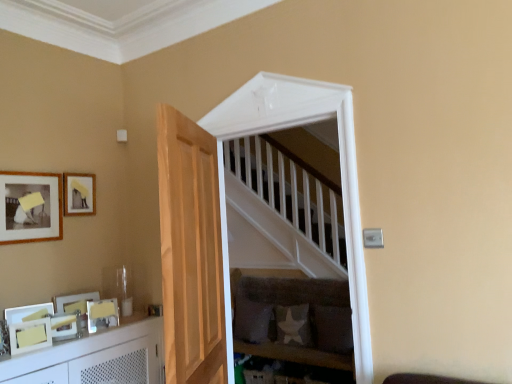
Locate an element on the screen. white glossy picture frame at lower left, placed as the 1th picture frame when sorted from bottom to top is located at coordinates [30, 336].

How much space does dark fabric pillow at lower center, which is the 1th pillow in right-to-left order, occupy horizontally?

The width of dark fabric pillow at lower center, which is the 1th pillow in right-to-left order, is 6.25 inches.

Find the location of `light brown wooden door at center`. light brown wooden door at center is located at coordinates tap(190, 251).

The width and height of the screenshot is (512, 384). What do you see at coordinates (26, 312) in the screenshot?
I see `matte white picture frame at lower left, the 3th picture frame from the top` at bounding box center [26, 312].

What do you see at coordinates (293, 325) in the screenshot? The image size is (512, 384). I see `white fabric pillow at lower center, arranged as the 2th pillow when viewed from the left` at bounding box center [293, 325].

Locate an element on the screen. white glossy picture frame at lower left, acting as the 5th picture frame starting from the top is located at coordinates coord(30,336).

Consider the image. From a real-world perspective, is light brown wooden door at center over white glossy picture frame at lower left, placed as the 1th picture frame when sorted from bottom to top?

Indeed, from a real-world perspective, light brown wooden door at center stands above white glossy picture frame at lower left, placed as the 1th picture frame when sorted from bottom to top.

Identify the location of door on the right of white glossy picture frame at lower left, placed as the 1th picture frame when sorted from bottom to top. (190, 251).

From the image's perspective, is light brown wooden door at center located above or below white glossy picture frame at lower left, placed as the 1th picture frame when sorted from bottom to top?

Based on their image positions, light brown wooden door at center is located above white glossy picture frame at lower left, placed as the 1th picture frame when sorted from bottom to top.

From the picture: In the image, is light brown wooden door at center on the left side or the right side of white glossy picture frame at lower left, placed as the 1th picture frame when sorted from bottom to top?

light brown wooden door at center is positioned on white glossy picture frame at lower left, placed as the 1th picture frame when sorted from bottom to top,'s right side.

Looking at this image, considering the sizes of objects light brown wooden door at center and white fabric pillow at lower center, placed as the first pillow when sorted from left to right, in the image provided, who is bigger, light brown wooden door at center or white fabric pillow at lower center, placed as the first pillow when sorted from left to right,?

Bigger between the two is light brown wooden door at center.

Considering the positions of point (202, 168) and point (246, 308), is point (202, 168) closer or farther from the camera than point (246, 308)?

Point (202, 168) is closer to the camera than point (246, 308).

From the image's perspective, relative to white fabric pillow at lower center, placed as the first pillow when sorted from left to right, is light brown wooden door at center above or below?

light brown wooden door at center is situated higher than white fabric pillow at lower center, placed as the first pillow when sorted from left to right, in the image.

Is light brown wooden door at center facing away from white fabric pillow at lower center, the 3th pillow viewed from the right?

No, light brown wooden door at center is not facing the opposite direction of white fabric pillow at lower center, the 3th pillow viewed from the right.

From a real-world perspective, is matte white picture frame at lower left, arranged as the 3th picture frame when ordered from the bottom, above or below matte gold picture frame at lower left, which is counted as the fourth picture frame, starting from the top?

In terms of real-world spatial position, matte white picture frame at lower left, arranged as the 3th picture frame when ordered from the bottom, is above matte gold picture frame at lower left, which is counted as the fourth picture frame, starting from the top.

Considering the relative sizes of matte white picture frame at lower left, arranged as the 3th picture frame when ordered from the bottom, and matte gold picture frame at lower left, which is counted as the fourth picture frame, starting from the top, in the image provided, is matte white picture frame at lower left, arranged as the 3th picture frame when ordered from the bottom, taller than matte gold picture frame at lower left, which is counted as the fourth picture frame, starting from the top,?

In fact, matte white picture frame at lower left, arranged as the 3th picture frame when ordered from the bottom, may be shorter than matte gold picture frame at lower left, which is counted as the fourth picture frame, starting from the top.

Is the depth of matte white picture frame at lower left, arranged as the 3th picture frame when ordered from the bottom, less than that of matte gold picture frame at lower left, which is the 2th picture frame in bottom-to-top order?

Yes, it is in front of matte gold picture frame at lower left, which is the 2th picture frame in bottom-to-top order.

Is the surface of light brown wooden door at center in direct contact with matte black picture frame at upper left, which ranks as the 4th picture frame in bottom-to-top order?

No, light brown wooden door at center is not with matte black picture frame at upper left, which ranks as the 4th picture frame in bottom-to-top order.

In the scene shown: Based on their sizes in the image, would you say light brown wooden door at center is bigger or smaller than matte black picture frame at upper left, which ranks as the 4th picture frame in bottom-to-top order?

In the image, light brown wooden door at center appears to be larger than matte black picture frame at upper left, which ranks as the 4th picture frame in bottom-to-top order.

Identify the location of door below the matte black picture frame at upper left, acting as the second picture frame starting from the top (from the image's perspective). This screenshot has width=512, height=384. (190, 251).

What's the angular difference between light brown wooden door at center and matte black picture frame at upper left, which ranks as the 4th picture frame in bottom-to-top order,'s facing directions?

The angle between the facing direction of light brown wooden door at center and the facing direction of matte black picture frame at upper left, which ranks as the 4th picture frame in bottom-to-top order, is 155 degrees.

From their relative heights in the image, would you say white wooden staircase at center is taller or shorter than white glossy picture frame at lower left, acting as the 5th picture frame starting from the top?

white wooden staircase at center is taller than white glossy picture frame at lower left, acting as the 5th picture frame starting from the top.

Could white glossy picture frame at lower left, placed as the 1th picture frame when sorted from bottom to top, be considered to be inside white wooden staircase at center?

No, white glossy picture frame at lower left, placed as the 1th picture frame when sorted from bottom to top, is not inside white wooden staircase at center.

Between white wooden staircase at center and white glossy picture frame at lower left, acting as the 5th picture frame starting from the top, which one has smaller width?

white glossy picture frame at lower left, acting as the 5th picture frame starting from the top.

Is white wooden staircase at center touching white glossy picture frame at lower left, acting as the 5th picture frame starting from the top?

white wooden staircase at center and white glossy picture frame at lower left, acting as the 5th picture frame starting from the top, are clearly separated.

Considering the relative positions of white fabric pillow at lower center, arranged as the 2th pillow when viewed from the left, and light brown wooden door at center in the image provided, is white fabric pillow at lower center, arranged as the 2th pillow when viewed from the left, behind light brown wooden door at center?

Yes, it is.

Is white fabric pillow at lower center, arranged as the 2th pillow when viewed from the left, facing towards light brown wooden door at center?

Yes, white fabric pillow at lower center, arranged as the 2th pillow when viewed from the left, is aimed at light brown wooden door at center.

Is white fabric pillow at lower center, arranged as the 2th pillow when viewed from the left, placed right next to light brown wooden door at center?

No, white fabric pillow at lower center, arranged as the 2th pillow when viewed from the left, is not touching light brown wooden door at center.

Can you confirm if white fabric pillow at lower center, arranged as the 2th pillow when viewed from the left, is taller than light brown wooden door at center?

Incorrect, the height of white fabric pillow at lower center, arranged as the 2th pillow when viewed from the left, is not larger of that of light brown wooden door at center.

How different are the orientations of white glossy picture frame at lower left, acting as the 5th picture frame starting from the top, and velvet grey sofa at center in degrees?

They differ by 82.1 degrees in their facing directions.

Considering the relative sizes of white glossy picture frame at lower left, placed as the 1th picture frame when sorted from bottom to top, and velvet grey sofa at center in the image provided, is white glossy picture frame at lower left, placed as the 1th picture frame when sorted from bottom to top, shorter than velvet grey sofa at center?

Yes, white glossy picture frame at lower left, placed as the 1th picture frame when sorted from bottom to top, is shorter than velvet grey sofa at center.

From the velvet grey sofa at center, count 5th picture frames forward and point to it. Please provide its 2D coordinates.

[(30, 336)]

Based on the photo, which of these two, white glossy picture frame at lower left, acting as the 5th picture frame starting from the top, or velvet grey sofa at center, is wider?

With larger width is velvet grey sofa at center.

Identify the location of the 1st picture frame behind when counting from the light brown wooden door at center. The image size is (512, 384). (30, 336).

Identify the location of the 1st pillow below the light brown wooden door at center (from a real-world perspective). Image resolution: width=512 pixels, height=384 pixels. (252, 321).

Considering their positions, is white wooden staircase at center positioned closer to matte yellow picture frame at upper left, which is counted as the first picture frame, starting from the top, than white fabric pillow at lower center, the 3th pillow viewed from the right?

white wooden staircase at center.

Based on their spatial positions, is white fabric pillow at lower center, the 3th pillow viewed from the right, or matte gold picture frame at lower left, which is counted as the fourth picture frame, starting from the top, closer to matte black picture frame at upper left, which ranks as the 4th picture frame in bottom-to-top order?

The object closer to matte black picture frame at upper left, which ranks as the 4th picture frame in bottom-to-top order, is matte gold picture frame at lower left, which is counted as the fourth picture frame, starting from the top.

Looking at the image, which one is located closer to velvet grey sofa at center, matte gold picture frame at lower left, which is counted as the fourth picture frame, starting from the top, or white fabric pillow at lower center, arranged as the 2th pillow when viewed from the left?

The object closer to velvet grey sofa at center is white fabric pillow at lower center, arranged as the 2th pillow when viewed from the left.

From the image, which object appears to be farther from velvet grey sofa at center, matte yellow picture frame at upper left, which is counted as the first picture frame, starting from the top, or white fabric pillow at lower center, placed as the first pillow when sorted from left to right?

The object further to velvet grey sofa at center is matte yellow picture frame at upper left, which is counted as the first picture frame, starting from the top.

Estimate the real-world distances between objects in this image. Which object is further from matte gold picture frame at lower left, which is counted as the fourth picture frame, starting from the top, white glossy picture frame at lower left, acting as the 5th picture frame starting from the top, or dark fabric pillow at lower center, which is the 1th pillow in right-to-left order?

dark fabric pillow at lower center, which is the 1th pillow in right-to-left order.

When comparing their distances from white fabric pillow at lower center, the 2th pillow positioned from the right, does white fabric pillow at lower center, the 3th pillow viewed from the right, or white glossy cabinet at lower left seem further?

Among the two, white glossy cabinet at lower left is located further to white fabric pillow at lower center, the 2th pillow positioned from the right.

From the image, which object appears to be nearer to light brown wooden door at center, white wooden staircase at center or white fabric pillow at lower center, the 3th pillow viewed from the right?

Based on the image, white wooden staircase at center appears to be nearer to light brown wooden door at center.

When comparing their distances from velvet grey sofa at center, does matte black picture frame at upper left, which ranks as the 4th picture frame in bottom-to-top order, or light brown wooden door at center seem further?

matte black picture frame at upper left, which ranks as the 4th picture frame in bottom-to-top order, is further to velvet grey sofa at center.

Find the location of a particular element. The width and height of the screenshot is (512, 384). furniture between white glossy cabinet at lower left and dark fabric pillow at lower center, which is the 1th pillow in right-to-left order is located at coordinates (296, 320).

What are the coordinates of `picture frame situated between white glossy cabinet at lower left and velvet grey sofa at center from left to right` in the screenshot? It's located at (102, 314).

Find the location of `window between matte black picture frame at upper left, which ranks as the 4th picture frame in bottom-to-top order, and velvet grey sofa at center`. window between matte black picture frame at upper left, which ranks as the 4th picture frame in bottom-to-top order, and velvet grey sofa at center is located at coordinates (341, 174).

The width and height of the screenshot is (512, 384). What are the coordinates of `furniture located between matte white picture frame at lower left, arranged as the 3th picture frame when ordered from the bottom, and white fabric pillow at lower center, the 2th pillow positioned from the right, in the left-right direction` in the screenshot? It's located at 296,320.